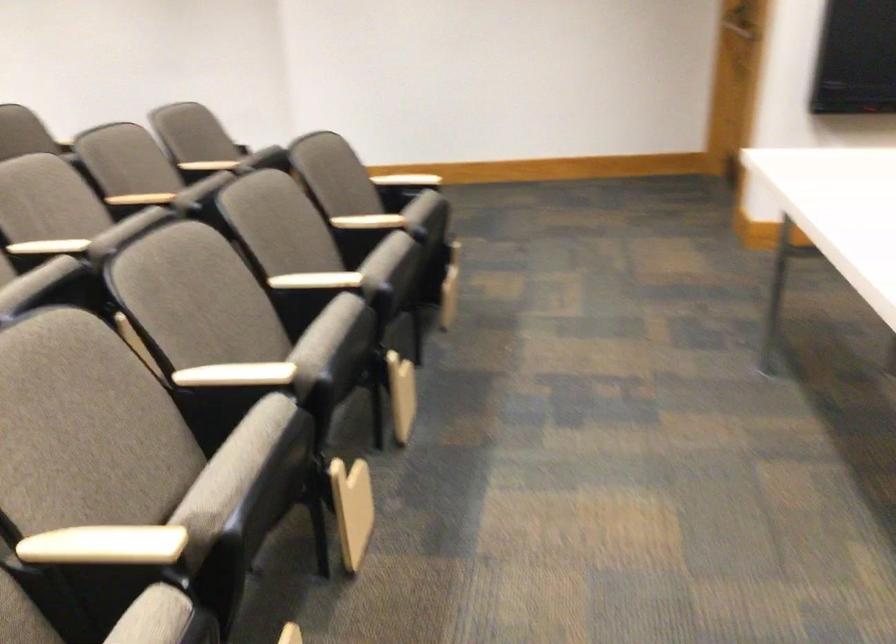
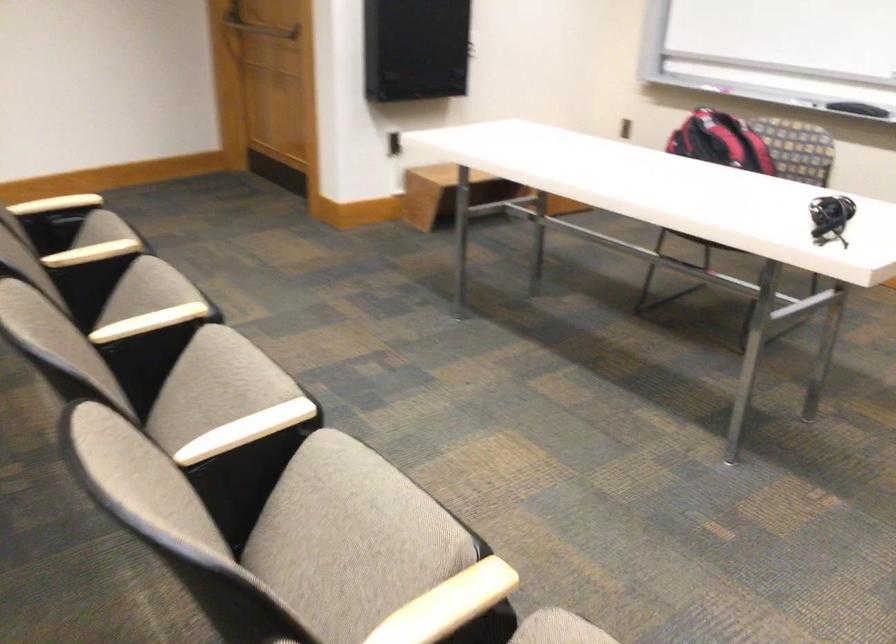
Locate, in the second image, the point that corresponds to pixel 314 275 in the first image.

(149, 322)